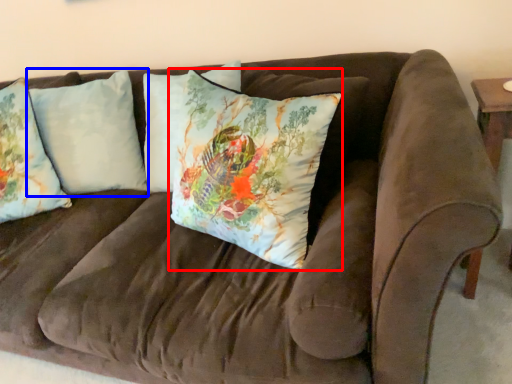
Question: Which object is closer to the camera taking this photo, pillow (highlighted by a red box) or pillow (highlighted by a blue box)?

Choices:
 (A) pillow
 (B) pillow

Answer: (A)